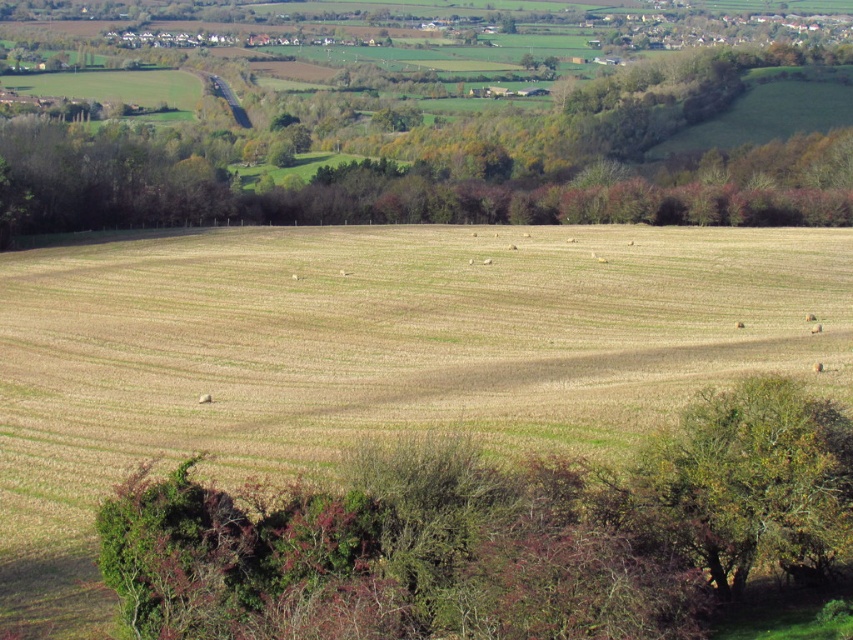
Locate an element on the screen. brown grassland at center is located at coordinates (381, 346).

Is brown grassland at center to the left of green leafy tree at lower right from the viewer's perspective?

Correct, you'll find brown grassland at center to the left of green leafy tree at lower right.

Which is in front, point (738, 268) or point (751, 461)?

Point (751, 461) is in front.

At what (x,y) coordinates should I click in order to perform the action: click on brown grassland at center. Please return your answer as a coordinate pair (x, y). This screenshot has height=640, width=853. Looking at the image, I should click on (381, 346).